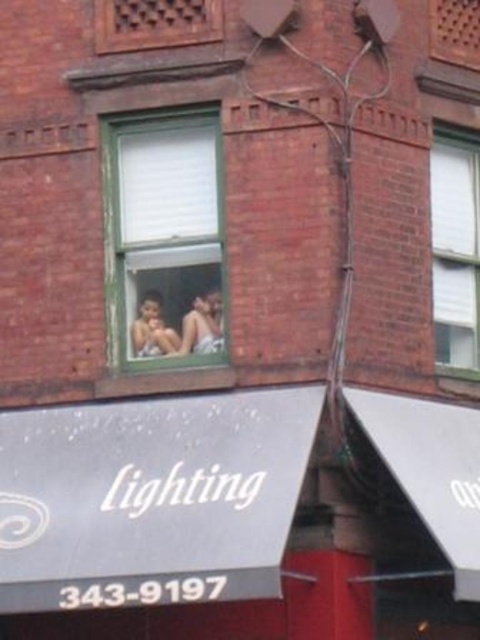
Question: Estimate the real-world distances between objects in this image. Which object is closer to the smooth skin person at center?

Choices:
 (A) white matte window at upper right
 (B) green wooden window at center
 (C) matte brown wooden window at upper center

Answer: (B)

Question: Which of the following is the farthest from the observer?

Choices:
 (A) (96, 10)
 (B) (170, 337)

Answer: (A)

Question: In this image, where is matte brown wooden window at upper center located relative to smooth skin person at center?

Choices:
 (A) left
 (B) right

Answer: (B)

Question: Can you confirm if white matte window at upper right is positioned above smooth skin person at center?

Choices:
 (A) no
 (B) yes

Answer: (B)

Question: Which object appears farthest from the camera in this image?

Choices:
 (A) white matte window at upper right
 (B) green wooden window at center
 (C) smooth skin person at center
 (D) matte brown wooden window at upper center

Answer: (A)

Question: Can you confirm if green wooden window at center is positioned below smooth skin person at center?

Choices:
 (A) no
 (B) yes

Answer: (A)